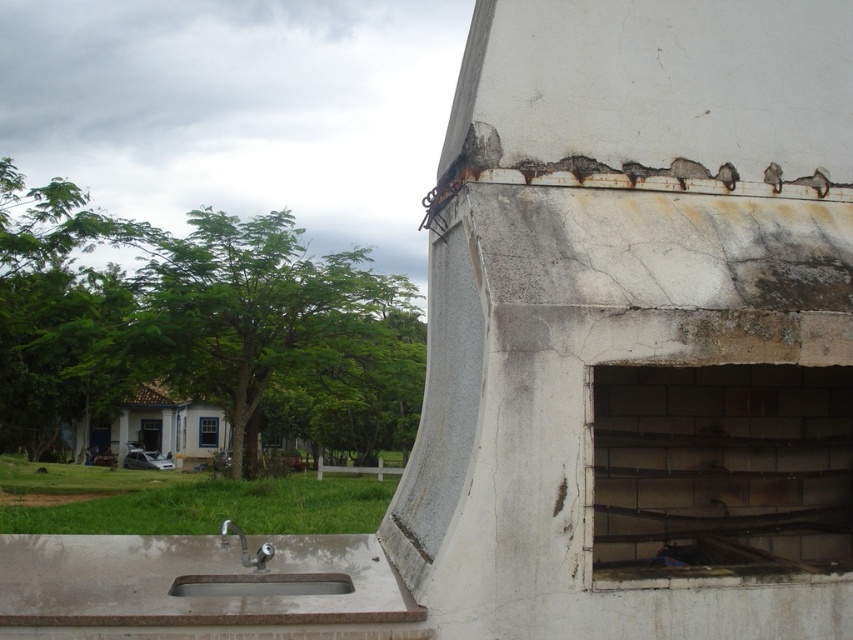
You are a contractor inspecting the site and need to locate both the rustic concrete sink at lower left and the rusty metal sink at lower left. According to the scene, which one is positioned further to the left?

The rustic concrete sink at lower left is positioned further to the left of the rusty metal sink at lower left.

You are standing in the outdoor area and want to wash your hands. You see the rustic concrete sink at lower left and the rusty metal sink at lower left. Which one is closer to you?

The rustic concrete sink at lower left is closer because it is in front of the rusty metal sink at lower left.